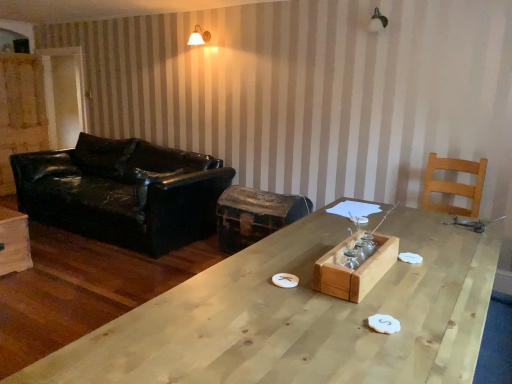
Find the location of `free space in front of wooden tray at center`. free space in front of wooden tray at center is located at coordinates (381, 316).